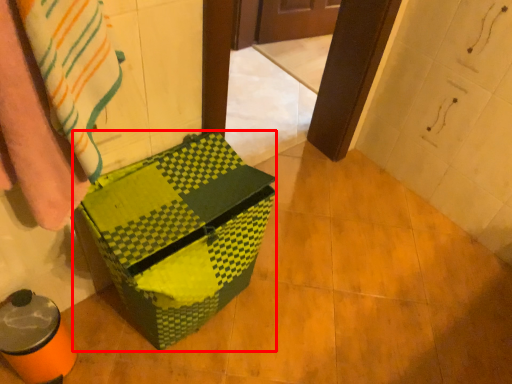
Question: From the image's perspective, where is cardboard box (annotated by the red box) located relative to blanket?

Choices:
 (A) above
 (B) below

Answer: (B)